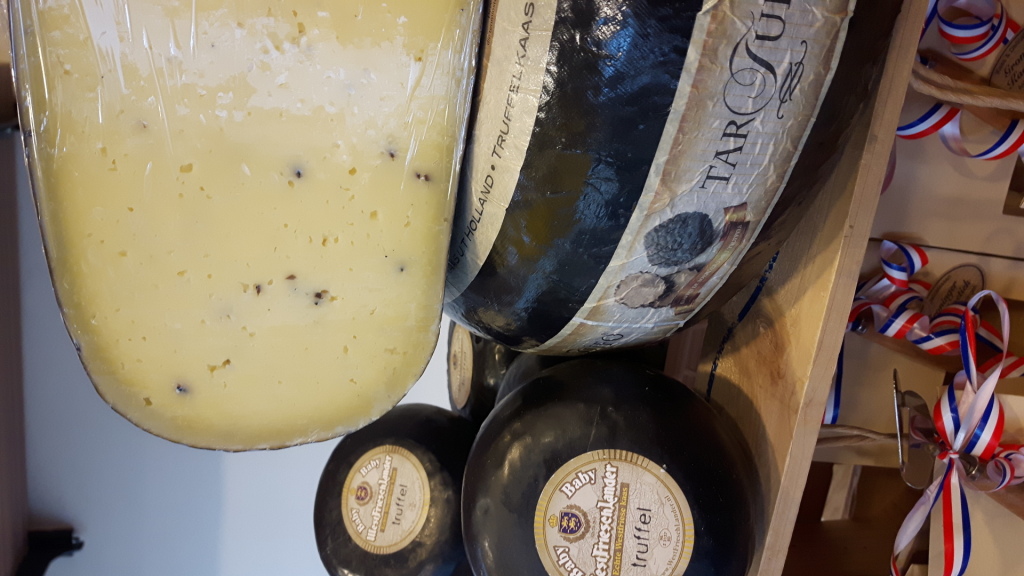
The height and width of the screenshot is (576, 1024). Identify the location of wood table. (357, 449).